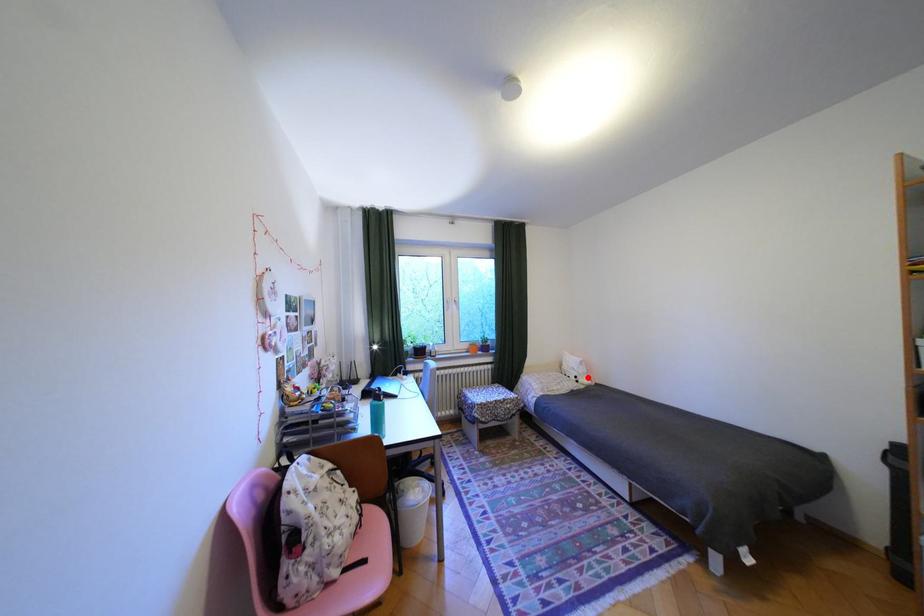
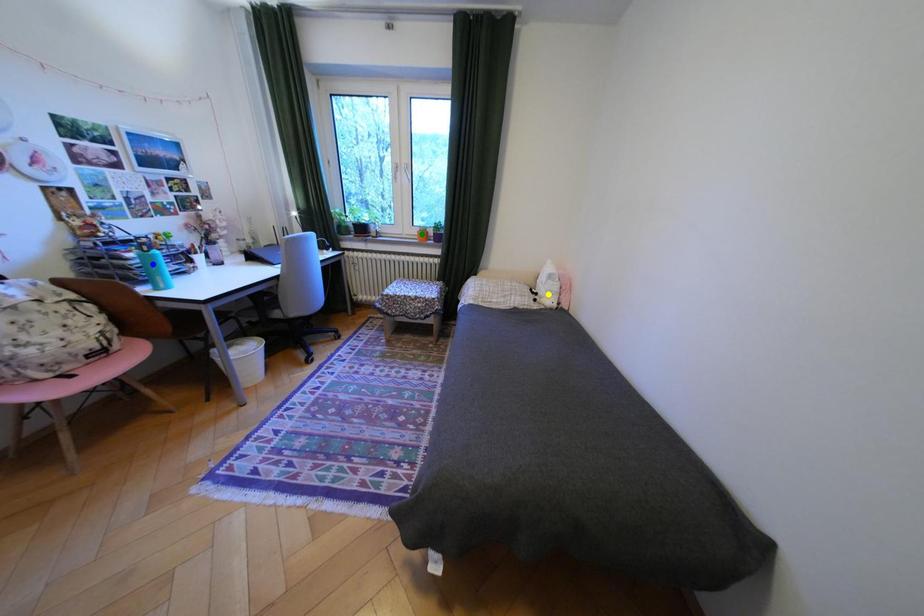
Question: I am providing you with two images of the same scene from different viewpoints. A red point is marked on the first image. You are given multiple points on the second image. Which point in image 2 represents the same 3d spot as the red point in image 1?

Choices:
 (A) green point
 (B) blue point
 (C) yellow point

Answer: (C)